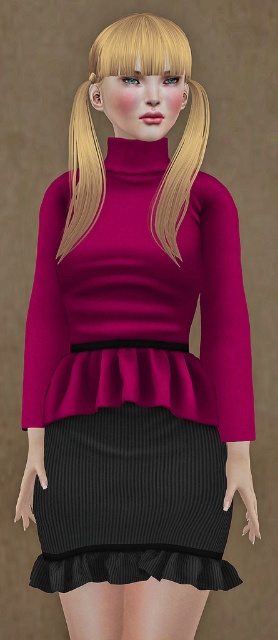
What do you see at coordinates (97, 138) in the screenshot? I see `blonde silky hair at upper center` at bounding box center [97, 138].

Who is more distant from viewer, (97, 160) or (90, 600)?

The point (97, 160) is more distant.

Find the location of `blonde silky hair at upper center`. blonde silky hair at upper center is located at coordinates (97, 138).

Can you confirm if black ribbed skirt at center is smaller than smooth beige tights at lower center?

Actually, black ribbed skirt at center might be larger than smooth beige tights at lower center.

This screenshot has height=640, width=278. What do you see at coordinates (132, 500) in the screenshot?
I see `black ribbed skirt at center` at bounding box center [132, 500].

Is point (211, 524) less distant than point (189, 628)?

Yes.

At what (x,y) coordinates should I click in order to perform the action: click on black ribbed skirt at center. Please return your answer as a coordinate pair (x, y). The height and width of the screenshot is (640, 278). Looking at the image, I should click on (132, 500).

Which is more to the left, matte pink sweater at center or black ribbed skirt at center?

black ribbed skirt at center

Who is shorter, matte pink sweater at center or black ribbed skirt at center?

black ribbed skirt at center is shorter.

Who is more distant from viewer, (41, 376) or (217, 563)?

The point (41, 376) is more distant.

In order to click on matte pink sweater at center in this screenshot , I will do (140, 312).